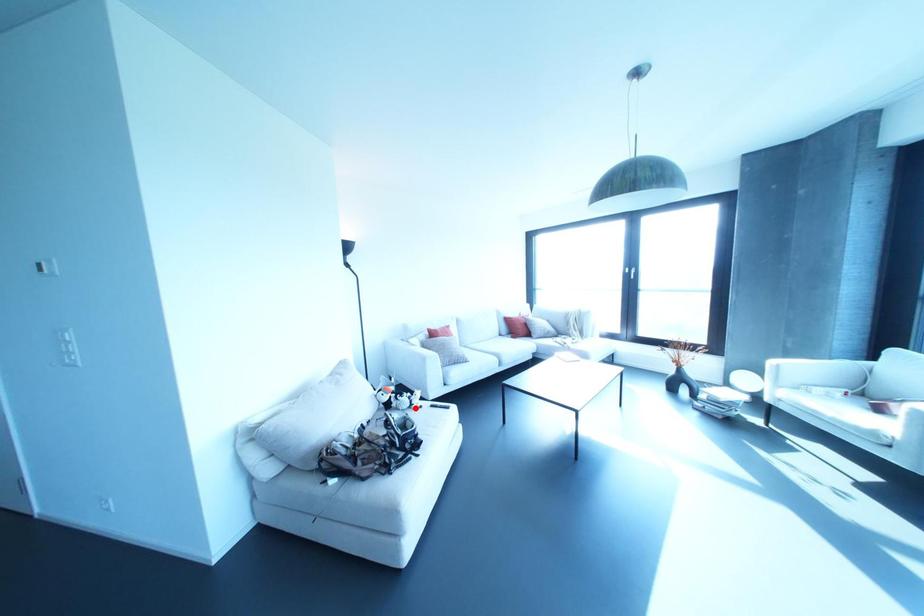
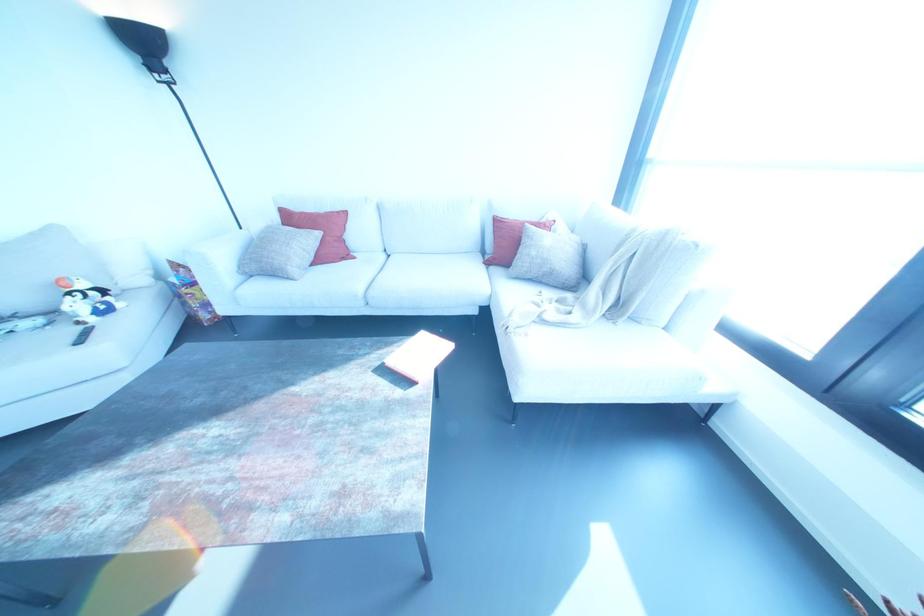
Question: I am providing you with two images of the same scene from different viewpoints. A red point is shown in image1. For the corresponding object point in image2, is it positioned nearer or farther from the camera?

Choices:
 (A) Nearer
 (B) Farther

Answer: (B)